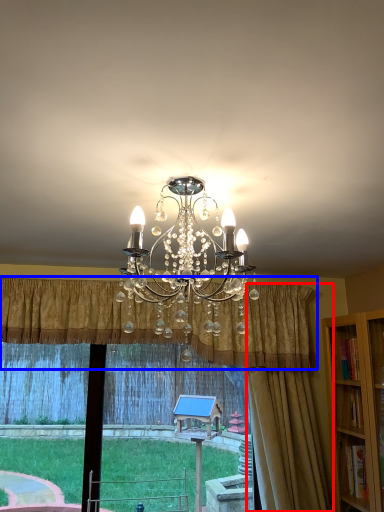
Question: Which of the following is the closest to the observer, curtain (highlighted by a red box) or curtain (highlighted by a blue box)?

Choices:
 (A) curtain
 (B) curtain

Answer: (B)